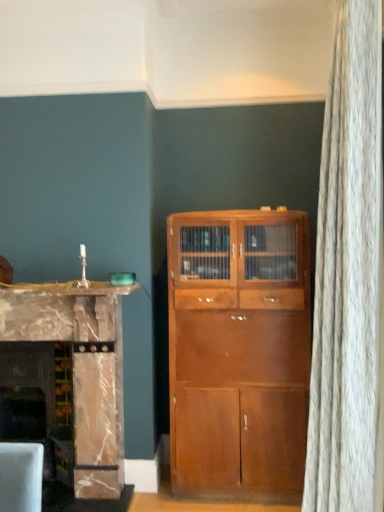
Question: Is marble fireplace at left oriented towards marble fireplace at left?

Choices:
 (A) no
 (B) yes

Answer: (A)

Question: From the image's perspective, is marble fireplace at left under marble fireplace at left?

Choices:
 (A) yes
 (B) no

Answer: (A)

Question: Is marble fireplace at left thinner than marble fireplace at left?

Choices:
 (A) no
 (B) yes

Answer: (A)

Question: From a real-world perspective, is marble fireplace at left positioned under marble fireplace at left based on gravity?

Choices:
 (A) yes
 (B) no

Answer: (A)

Question: Can you confirm if marble fireplace at left is positioned to the left of marble fireplace at left?

Choices:
 (A) yes
 (B) no

Answer: (A)

Question: Is marble fireplace at left placed right next to marble fireplace at left?

Choices:
 (A) yes
 (B) no

Answer: (B)

Question: Is marble fireplace at left not within marble fireplace at left?

Choices:
 (A) no
 (B) yes

Answer: (B)

Question: Is the position of marble fireplace at left more distant than that of marble fireplace at left?

Choices:
 (A) no
 (B) yes

Answer: (A)

Question: Considering the relative sizes of marble fireplace at left and marble fireplace at left in the image provided, is marble fireplace at left wider than marble fireplace at left?

Choices:
 (A) no
 (B) yes

Answer: (A)

Question: From the image's perspective, is marble fireplace at left below marble fireplace at left?

Choices:
 (A) yes
 (B) no

Answer: (B)

Question: Can you confirm if marble fireplace at left is positioned to the left of marble fireplace at left?

Choices:
 (A) yes
 (B) no

Answer: (B)

Question: Does marble fireplace at left turn towards marble fireplace at left?

Choices:
 (A) yes
 (B) no

Answer: (B)

Question: From the image's perspective, is marble fireplace at left beneath shiny brown cabinet at center?

Choices:
 (A) yes
 (B) no

Answer: (B)